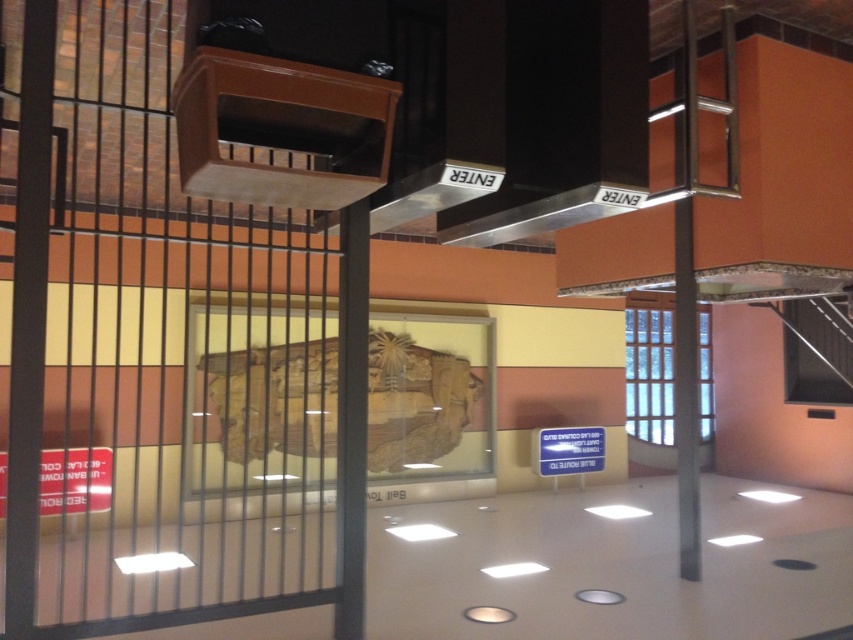
Question: Which point appears closest to the camera in this image?

Choices:
 (A) (270, 392)
 (B) (634, 205)
 (C) (219, 410)

Answer: (B)

Question: Is wooden slats at left to the right of wooden carving at center from the viewer's perspective?

Choices:
 (A) yes
 (B) no

Answer: (B)

Question: Can you confirm if wooden slats at left is wider than silver metallic exhaust hood at center?

Choices:
 (A) yes
 (B) no

Answer: (A)

Question: Considering the relative positions of wooden carving at center and silver metallic exhaust hood at center in the image provided, where is wooden carving at center located with respect to silver metallic exhaust hood at center?

Choices:
 (A) above
 (B) below

Answer: (B)

Question: Which of the following is the closest to the observer?

Choices:
 (A) (158, 144)
 (B) (270, 410)
 (C) (534, 221)

Answer: (C)

Question: Which of the following is the farthest from the observer?

Choices:
 (A) (71, 51)
 (B) (386, 384)

Answer: (B)